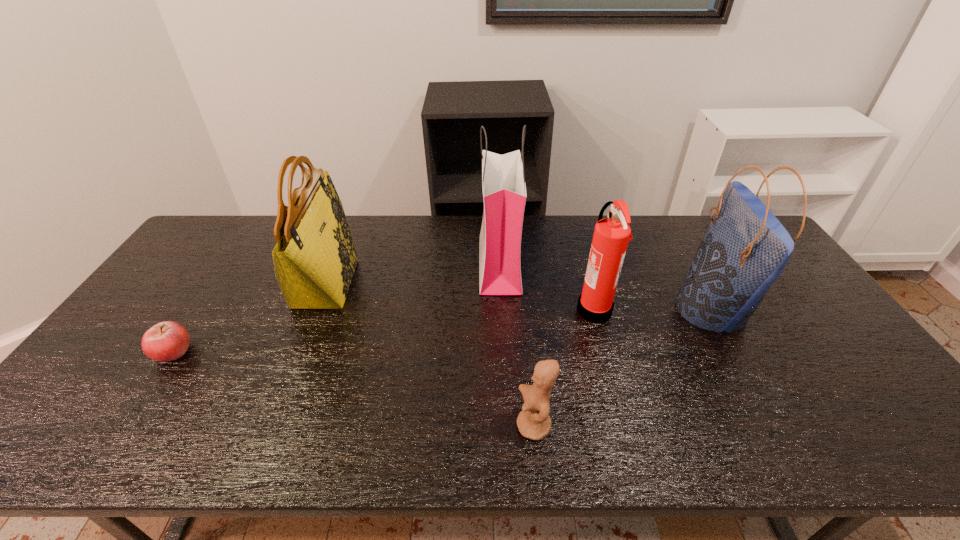
This screenshot has height=540, width=960. Identify the location of the left shopping bag. (504, 191).

Where is `the rightmost object`? The image size is (960, 540). the rightmost object is located at coordinates (745, 248).

This screenshot has width=960, height=540. In order to click on tote bag in this screenshot , I will do `click(314, 259)`.

The width and height of the screenshot is (960, 540). In order to click on the second object from right to left in this screenshot , I will do `click(611, 236)`.

Identify the location of the nearest object. (533, 422).

This screenshot has height=540, width=960. What are the coordinates of `figurine` in the screenshot? It's located at coord(533,422).

Locate an element on the screen. The width and height of the screenshot is (960, 540). the leftmost object is located at coordinates (166, 341).

The height and width of the screenshot is (540, 960). Identify the location of apple. (166, 341).

Where is `vacant space located on the front-facing side of the left shopping bag`? This screenshot has height=540, width=960. vacant space located on the front-facing side of the left shopping bag is located at coordinates (448, 264).

At what (x,y) coordinates should I click in order to perform the action: click on free region located on the front-facing side of the left shopping bag. Please return your answer as a coordinate pair (x, y). The width and height of the screenshot is (960, 540). Looking at the image, I should click on (415, 264).